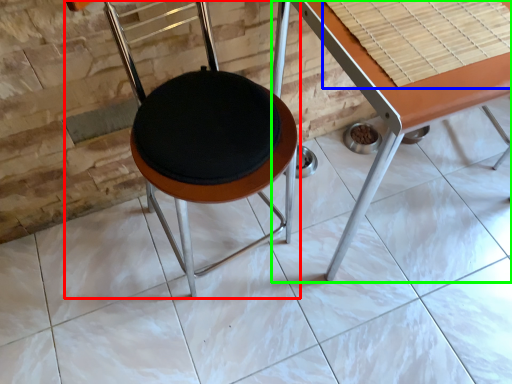
Question: Estimate the real-world distances between objects in this image. Which object is closer to chair (highlighted by a red box), table top (highlighted by a blue box) or table (highlighted by a green box)?

Choices:
 (A) table top
 (B) table

Answer: (B)